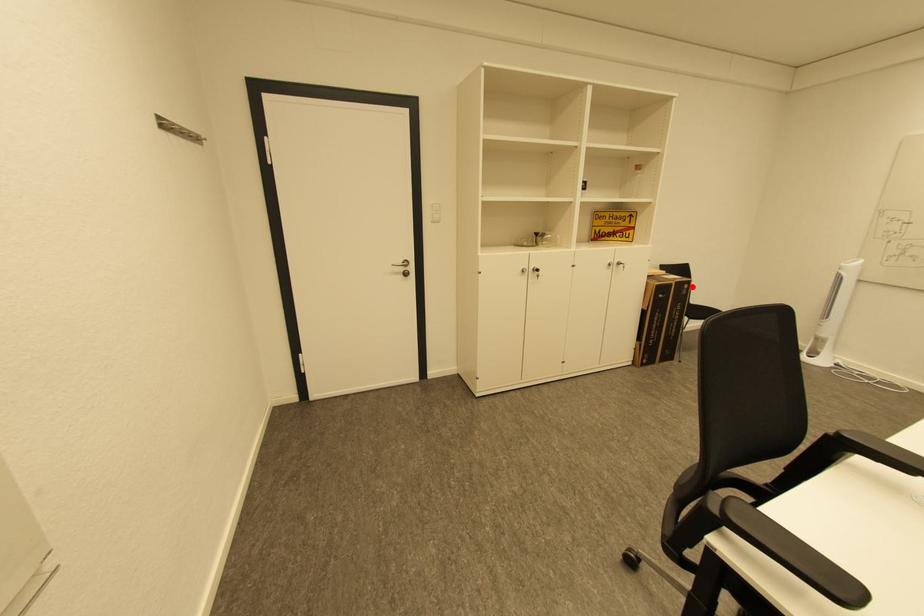
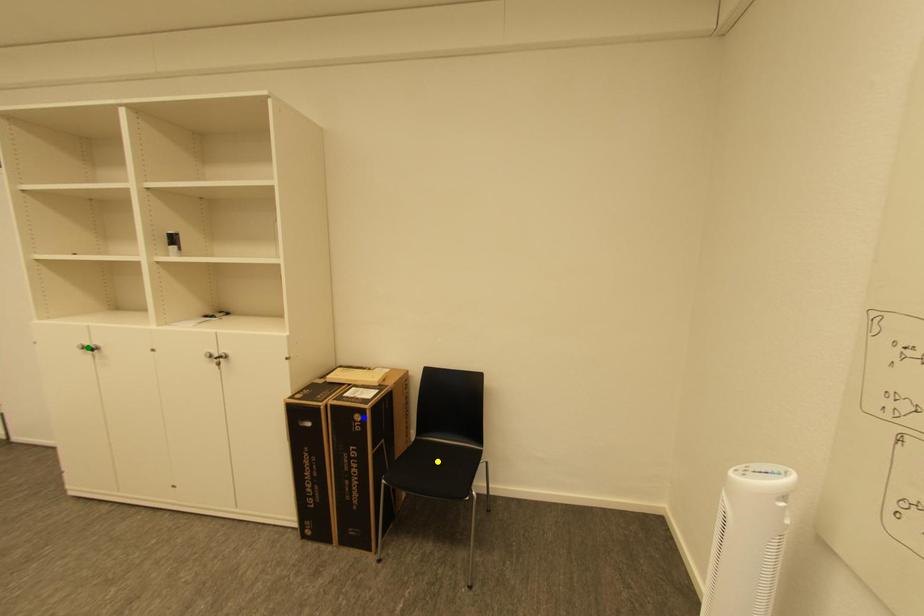
Question: I am providing you with two images of the same scene from different viewpoints. A red point is marked on the first image. You are given multiple points on the second image. In image 2, which mark is for the same physical point as the one in image 1?

Choices:
 (A) blue point
 (B) green point
 (C) yellow point

Answer: (A)